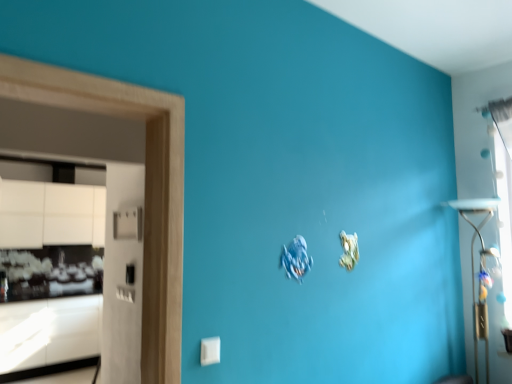
Question: Do you think transparent glass window at upper right is within white glossy cabinetry at left, or outside of it?

Choices:
 (A) outside
 (B) inside

Answer: (A)

Question: Relative to white glossy cabinetry at left, is transparent glass window at upper right in front or behind?

Choices:
 (A) front
 (B) behind

Answer: (A)

Question: Considering the positions of transparent glass window at upper right and white glossy cabinetry at left in the image, is transparent glass window at upper right wider or thinner than white glossy cabinetry at left?

Choices:
 (A) thin
 (B) wide

Answer: (A)

Question: Does point (8, 365) appear closer or farther from the camera than point (502, 243)?

Choices:
 (A) closer
 (B) farther

Answer: (B)

Question: From a real-world perspective, is white glossy cabinetry at left above or below transparent glass window at upper right?

Choices:
 (A) below
 (B) above

Answer: (A)

Question: In terms of size, does white glossy cabinetry at left appear bigger or smaller than transparent glass window at upper right?

Choices:
 (A) small
 (B) big

Answer: (B)

Question: Choose the correct answer: Is white glossy cabinetry at left inside transparent glass window at upper right or outside it?

Choices:
 (A) inside
 (B) outside

Answer: (B)